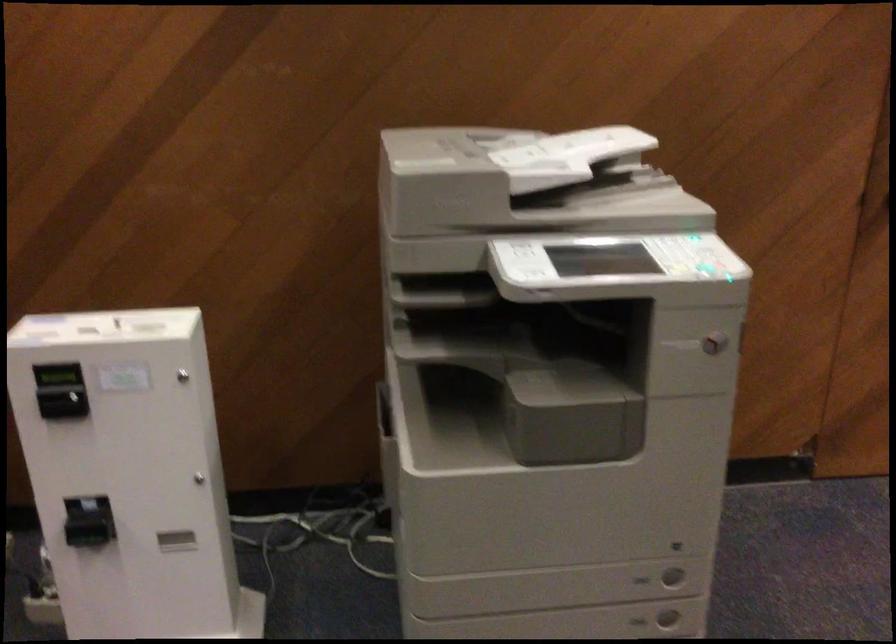
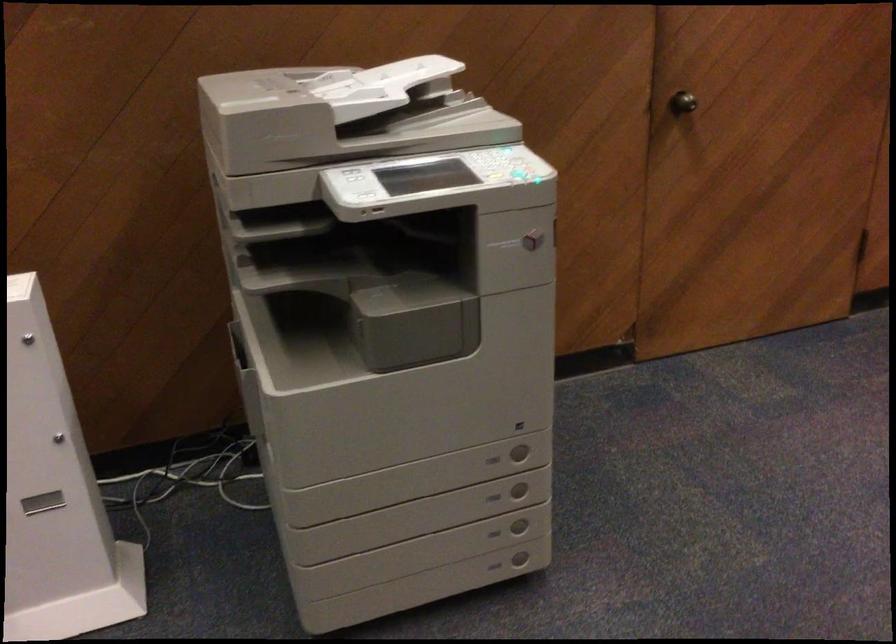
Find the pixel in the second image that matches point (562, 152) in the first image.

(376, 86)